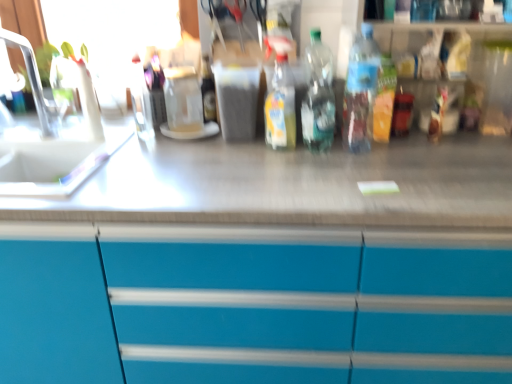
This screenshot has width=512, height=384. I want to click on free space behind white plastic faucet at left, so click(47, 132).